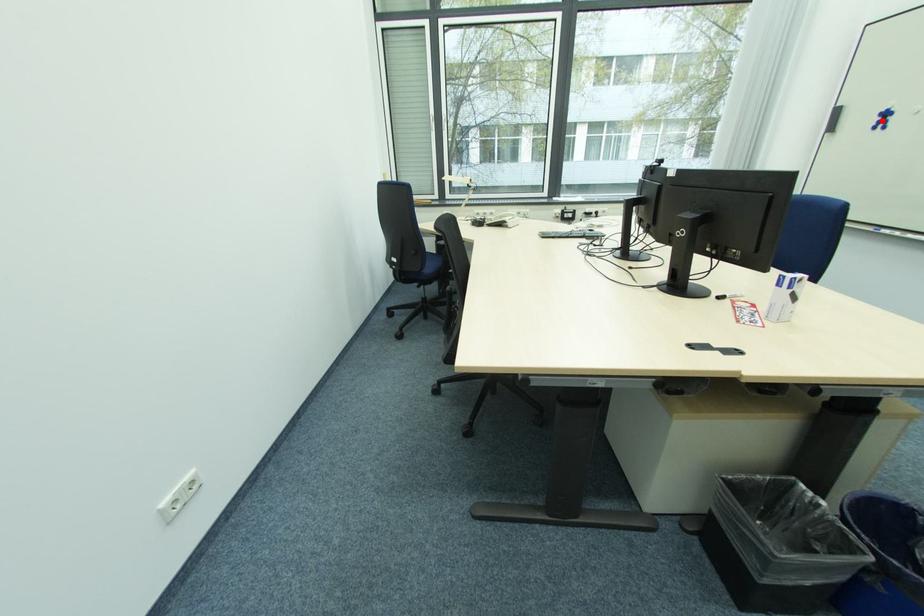
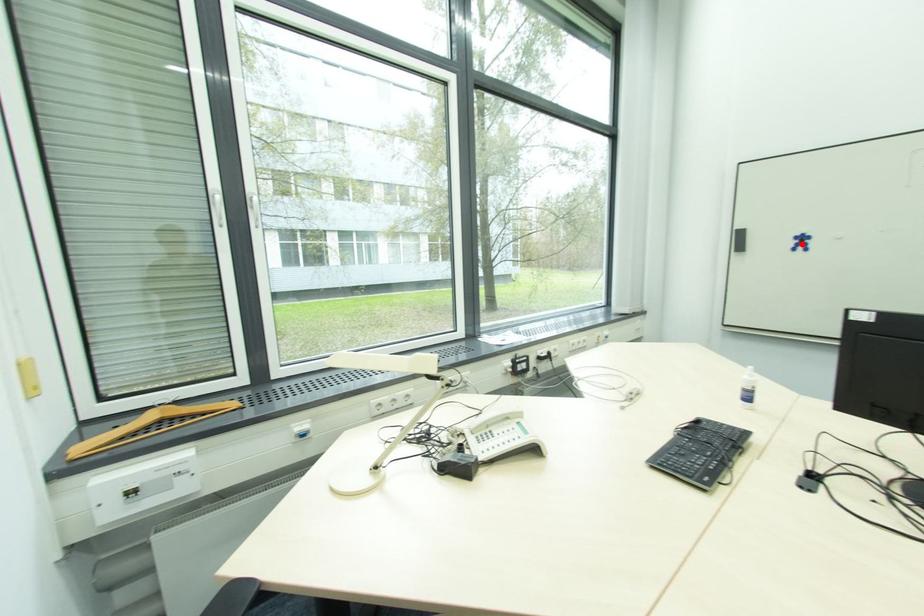
I am providing you with two images of the same scene from different viewpoints. A red point is marked on the first image and another point is marked on the second image. Is the red point in image1 aligned with the point shown in image2?

Yes